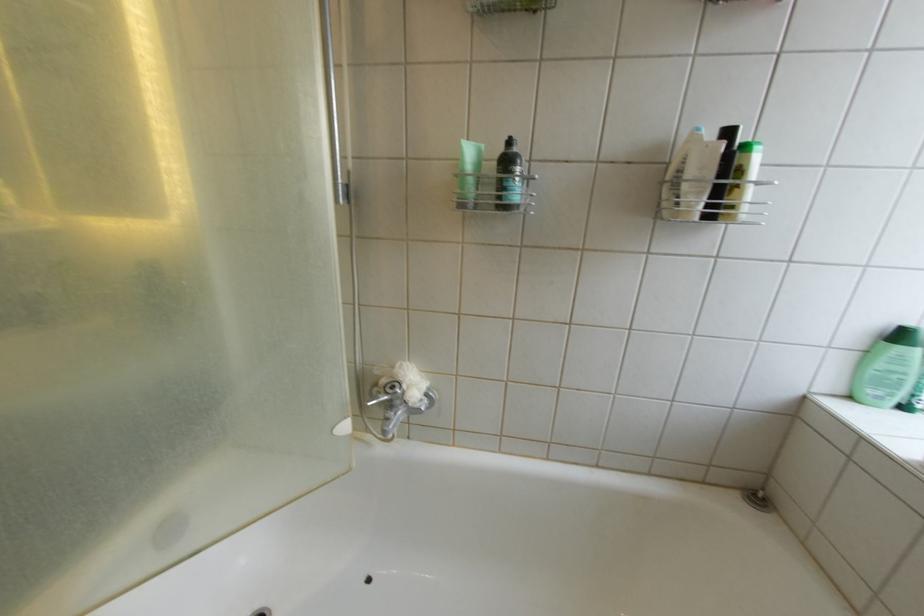
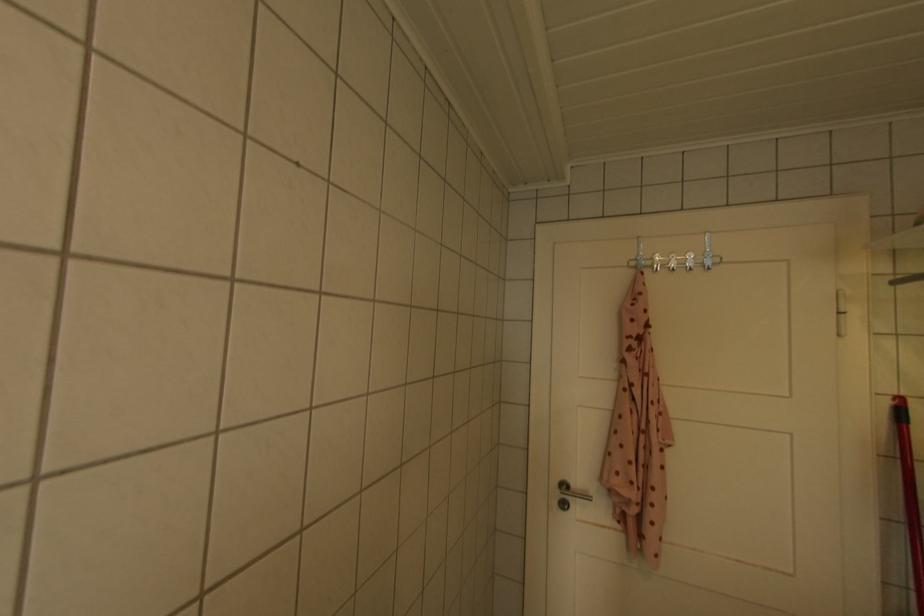
Question: The camera is either moving clockwise (left) or counter-clockwise (right) around the object. The first image is from the beginning of the video and the second image is from the end. Is the camera moving left or right when shooting the video?

Choices:
 (A) Left
 (B) Right

Answer: (B)